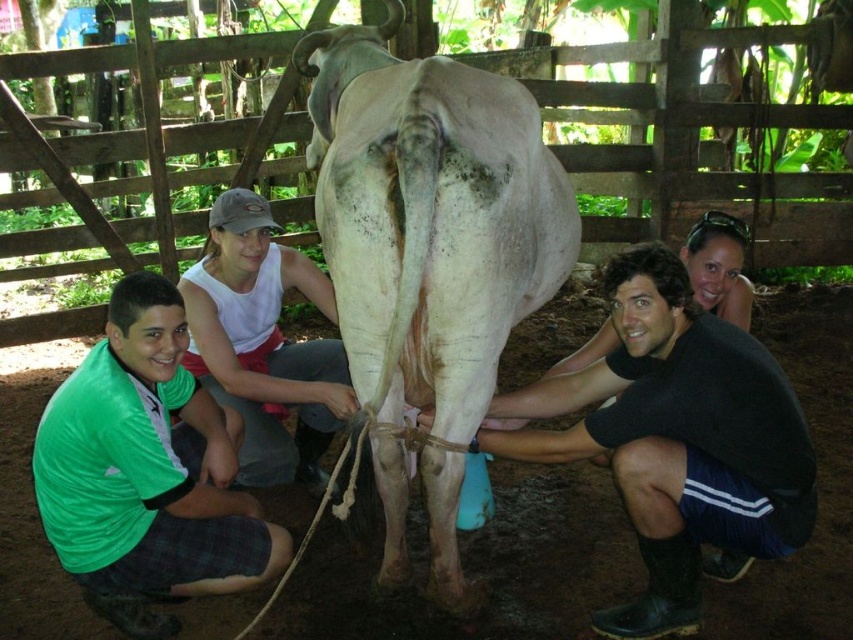
Question: Does white matte cow at center appear under black rubber boots at lower right?

Choices:
 (A) no
 (B) yes

Answer: (A)

Question: Which object is the closest to the black rubber boots at lower right?

Choices:
 (A) green fabric shirt at center
 (B) white matte cow at center
 (C) green fabric shirt at lower left

Answer: (B)

Question: Estimate the real-world distances between objects in this image. Which object is closer to the black rubber boots at lower right?

Choices:
 (A) white matte cow at center
 (B) green fabric shirt at lower left
 (C) green fabric shirt at center

Answer: (A)

Question: Which of these objects is positioned farthest from the white matte cow at center?

Choices:
 (A) green fabric shirt at center
 (B) black rubber boots at lower right
 (C) green fabric shirt at lower left

Answer: (C)

Question: Does white matte cow at center appear on the right side of black rubber boots at lower right?

Choices:
 (A) yes
 (B) no

Answer: (B)

Question: Is green fabric shirt at lower left above green fabric shirt at center?

Choices:
 (A) yes
 (B) no

Answer: (B)